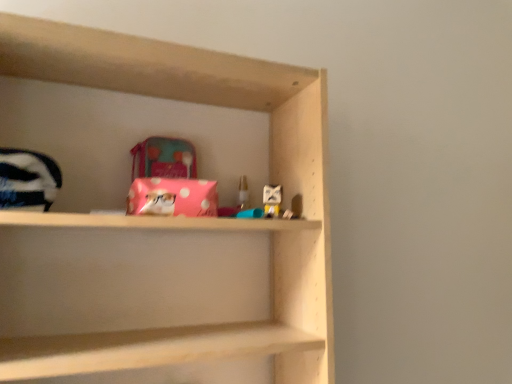
Find the location of a particular element. translucent plastic candle at center, which appears as the first toy when viewed from the left is located at coordinates (243, 192).

You are a GUI agent. You are given a task and a screenshot of the screen. Output one action in this format:
    pyautogui.click(x=<x>, y=<y>)
    Task: Click on the pink polka dot plush at upper center, the 2th toy when ordered from back to front
    This screenshot has height=384, width=512.
    Given the screenshot: What is the action you would take?
    pyautogui.click(x=272, y=200)

Would you consider pink polka dot fabric at center to be distant from pink polka dot plush at upper center, the first toy positioned from the front?

pink polka dot fabric at center is near pink polka dot plush at upper center, the first toy positioned from the front, not far away.

From a real-world perspective, relative to pink polka dot plush at upper center, the first toy viewed from the right, is pink polka dot fabric at center vertically above or below?

pink polka dot fabric at center is above pink polka dot plush at upper center, the first toy viewed from the right.

Is pink polka dot fabric at center shorter than pink polka dot plush at upper center, the 2th toy when ordered from back to front?

In fact, pink polka dot fabric at center may be taller than pink polka dot plush at upper center, the 2th toy when ordered from back to front.

Which toy is the 2nd one when counting from the back of the pink polka dot fabric at center? Please provide its 2D coordinates.

[(243, 192)]

Does point (245, 187) come in front of point (177, 201)?

That is False.

Visually, is translucent plastic candle at center, placed as the 2th toy when sorted from right to left, positioned to the left or to the right of pink polka dot fabric at center?

In the image, translucent plastic candle at center, placed as the 2th toy when sorted from right to left, appears on the right side of pink polka dot fabric at center.

Is translucent plastic candle at center, which ranks as the 2th toy in front-to-back order, with pink polka dot fabric at center?

No, translucent plastic candle at center, which ranks as the 2th toy in front-to-back order, is not making contact with pink polka dot fabric at center.

Is point (269, 193) positioned after point (245, 185)?

That is False.

Locate an element on the screen. This screenshot has width=512, height=384. toy on the left of pink polka dot plush at upper center, the first toy positioned from the front is located at coordinates (243, 192).

Is pink polka dot plush at upper center, the first toy viewed from the right, at the right side of translucent plastic candle at center, positioned as the first toy in back-to-front order?

Yes, pink polka dot plush at upper center, the first toy viewed from the right, is to the right of translucent plastic candle at center, positioned as the first toy in back-to-front order.

Which object is positioned more to the left, pink polka dot fabric at center or translucent plastic candle at center, placed as the 2th toy when sorted from right to left?

pink polka dot fabric at center is more to the left.

Between pink polka dot fabric at center and translucent plastic candle at center, placed as the 2th toy when sorted from right to left, which one has more height?

With more height is pink polka dot fabric at center.

Which point is more distant from viewer, (132, 197) or (241, 203)?

The point (241, 203) is behind.

Does pink polka dot fabric at center touch translucent plastic candle at center, which appears as the first toy when viewed from the left?

No, pink polka dot fabric at center is not in contact with translucent plastic candle at center, which appears as the first toy when viewed from the left.

Does pink polka dot plush at upper center, the first toy positioned from the front, touch pink polka dot fabric at center?

No, pink polka dot plush at upper center, the first toy positioned from the front, is not touching pink polka dot fabric at center.

Between pink polka dot plush at upper center, the first toy positioned from the front, and pink polka dot fabric at center, which one has smaller size?

Smaller between the two is pink polka dot plush at upper center, the first toy positioned from the front.

Is pink polka dot plush at upper center, the 2th toy when ordered from back to front, oriented towards pink polka dot fabric at center?

No, pink polka dot plush at upper center, the 2th toy when ordered from back to front, is not aimed at pink polka dot fabric at center.

Which object is further away from the camera taking this photo, pink polka dot plush at upper center, the first toy viewed from the right, or pink polka dot fabric at center?

pink polka dot plush at upper center, the first toy viewed from the right, is behind.

From the image's perspective, is translucent plastic candle at center, which ranks as the 2th toy in front-to-back order, on pink polka dot plush at upper center, the 2th toy when ordered from back to front?

Correct, translucent plastic candle at center, which ranks as the 2th toy in front-to-back order, appears higher than pink polka dot plush at upper center, the 2th toy when ordered from back to front, in the image.

Relative to pink polka dot plush at upper center, the 2th toy when ordered from back to front, is translucent plastic candle at center, placed as the 2th toy when sorted from right to left, in front or behind?

translucent plastic candle at center, placed as the 2th toy when sorted from right to left, is positioned farther from the viewer than pink polka dot plush at upper center, the 2th toy when ordered from back to front.

Can you confirm if translucent plastic candle at center, placed as the 2th toy when sorted from right to left, is taller than pink polka dot plush at upper center, the first toy positioned from the front?

Indeed, translucent plastic candle at center, placed as the 2th toy when sorted from right to left, has a greater height compared to pink polka dot plush at upper center, the first toy positioned from the front.

Is translucent plastic candle at center, positioned as the first toy in back-to-front order, far from pink polka dot plush at upper center, the second toy positioned from the left?

translucent plastic candle at center, positioned as the first toy in back-to-front order, is near pink polka dot plush at upper center, the second toy positioned from the left, not far away.

Locate an element on the screen. The height and width of the screenshot is (384, 512). material on the left of pink polka dot plush at upper center, the first toy viewed from the right is located at coordinates (172, 197).

You are a GUI agent. You are given a task and a screenshot of the screen. Output one action in this format:
    pyautogui.click(x=<x>, y=<y>)
    Task: Click on the toy above the pink polka dot fabric at center (from the image's perspective)
    
    Given the screenshot: What is the action you would take?
    pyautogui.click(x=243, y=192)

From the image, which object appears to be nearer to translucent plastic candle at center, positioned as the first toy in back-to-front order, pink polka dot fabric at center or pink polka dot plush at upper center, the first toy positioned from the front?

pink polka dot plush at upper center, the first toy positioned from the front, lies closer to translucent plastic candle at center, positioned as the first toy in back-to-front order, than the other object.

When comparing their distances from pink polka dot fabric at center, does pink polka dot plush at upper center, the 2th toy when ordered from back to front, or translucent plastic candle at center, which appears as the first toy when viewed from the left, seem further?

Among the two, translucent plastic candle at center, which appears as the first toy when viewed from the left, is located further to pink polka dot fabric at center.

Estimate the real-world distances between objects in this image. Which object is further from pink polka dot plush at upper center, the 2th toy when ordered from back to front, pink polka dot fabric at center or translucent plastic candle at center, positioned as the first toy in back-to-front order?

pink polka dot fabric at center is further to pink polka dot plush at upper center, the 2th toy when ordered from back to front.

Which object lies further to the anchor point pink polka dot fabric at center, translucent plastic candle at center, placed as the 2th toy when sorted from right to left, or pink polka dot plush at upper center, the first toy viewed from the right?

The object further to pink polka dot fabric at center is translucent plastic candle at center, placed as the 2th toy when sorted from right to left.

Based on their spatial positions, is translucent plastic candle at center, placed as the 2th toy when sorted from right to left, or pink polka dot fabric at center further from pink polka dot plush at upper center, the 2th toy when ordered from back to front?

The object further to pink polka dot plush at upper center, the 2th toy when ordered from back to front, is pink polka dot fabric at center.

Based on their spatial positions, is pink polka dot plush at upper center, the first toy positioned from the front, or pink polka dot fabric at center closer to translucent plastic candle at center, which ranks as the 2th toy in front-to-back order?

pink polka dot plush at upper center, the first toy positioned from the front, lies closer to translucent plastic candle at center, which ranks as the 2th toy in front-to-back order, than the other object.

Locate an element on the screen. The image size is (512, 384). toy between pink polka dot fabric at center and translucent plastic candle at center, which appears as the first toy when viewed from the left, along the z-axis is located at coordinates (272, 200).